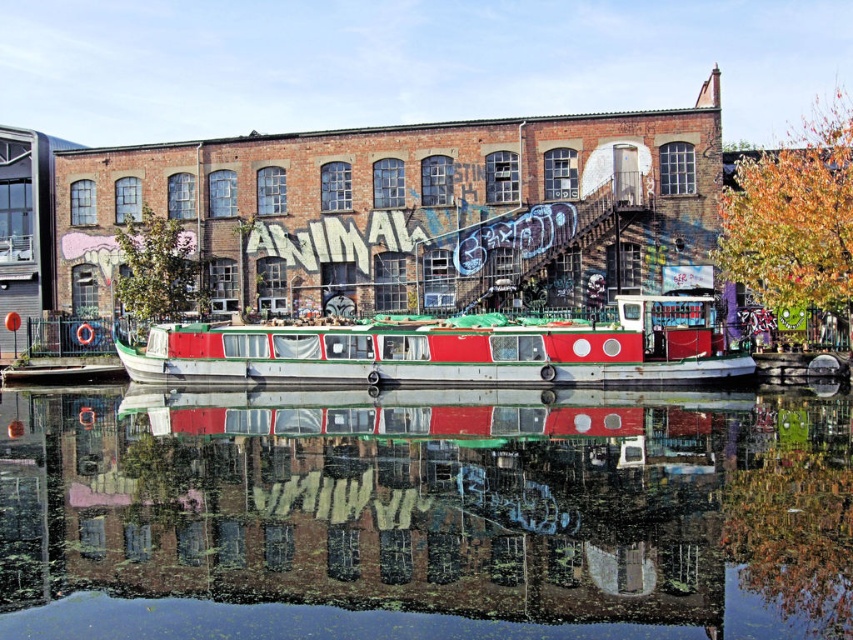
Between green reflective water at center and white glossy barge at center, which one appears on the left side from the viewer's perspective?

From the viewer's perspective, green reflective water at center appears more on the left side.

Does point (274, 541) come in front of point (550, 378)?

Yes, it is in front of point (550, 378).

Where is `green reflective water at center`? green reflective water at center is located at coordinates (424, 518).